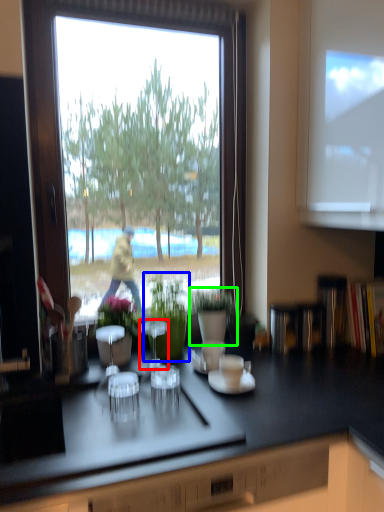
Question: Which object is the closest to the appliance (highlighted by a red box)? Choose among these: houseplant (highlighted by a blue box) or houseplant (highlighted by a green box).

Choices:
 (A) houseplant
 (B) houseplant

Answer: (A)